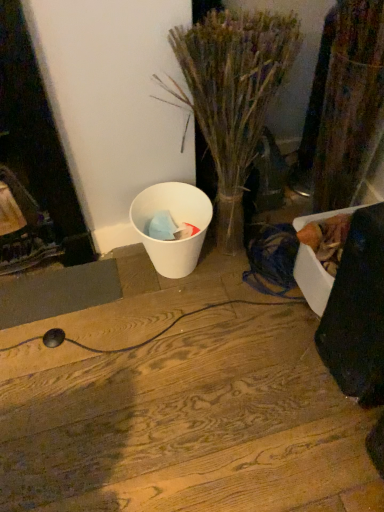
Question: Is white matte trash can at lower left looking in the opposite direction of translucent glass vase at center?

Choices:
 (A) no
 (B) yes

Answer: (A)

Question: Is white matte trash can at lower left to the right of translucent glass vase at center from the viewer's perspective?

Choices:
 (A) yes
 (B) no

Answer: (B)

Question: Does white matte trash can at lower left appear on the left side of translucent glass vase at center?

Choices:
 (A) no
 (B) yes

Answer: (B)

Question: Is white matte trash can at lower left completely or partially outside of translucent glass vase at center?

Choices:
 (A) yes
 (B) no

Answer: (B)

Question: Considering the relative sizes of white matte trash can at lower left and translucent glass vase at center in the image provided, is white matte trash can at lower left taller than translucent glass vase at center?

Choices:
 (A) no
 (B) yes

Answer: (A)

Question: Can you confirm if white matte trash can at lower left is smaller than translucent glass vase at center?

Choices:
 (A) no
 (B) yes

Answer: (B)

Question: Is translucent glass vase at center next to wooden floor at center and touching it?

Choices:
 (A) yes
 (B) no

Answer: (B)

Question: Could wooden floor at center be considered to be inside translucent glass vase at center?

Choices:
 (A) yes
 (B) no

Answer: (B)

Question: Does translucent glass vase at center come behind wooden floor at center?

Choices:
 (A) no
 (B) yes

Answer: (A)

Question: Is translucent glass vase at center oriented away from wooden floor at center?

Choices:
 (A) no
 (B) yes

Answer: (A)

Question: Is there a large distance between translucent glass vase at center and wooden floor at center?

Choices:
 (A) yes
 (B) no

Answer: (B)

Question: Does translucent glass vase at center appear on the left side of wooden floor at center?

Choices:
 (A) yes
 (B) no

Answer: (B)

Question: Considering the relative sizes of translucent glass vase at center and white matte trash can at lower left in the image provided, is translucent glass vase at center shorter than white matte trash can at lower left?

Choices:
 (A) yes
 (B) no

Answer: (B)